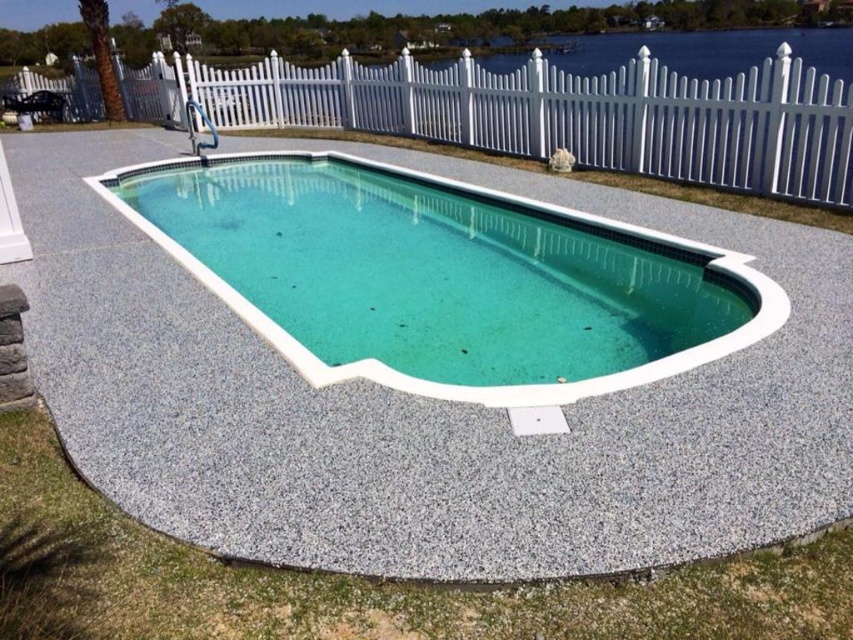
Question: From the image, what is the correct spatial relationship of white plastic fence at upper center in relation to clear acrylic pool at center?

Choices:
 (A) above
 (B) below

Answer: (A)

Question: Among these objects, which one is nearest to the camera?

Choices:
 (A) white plastic fence at upper center
 (B) clear acrylic pool at center

Answer: (B)

Question: Among these points, which one is farthest from the camera?

Choices:
 (A) (546, 70)
 (B) (769, 332)

Answer: (A)

Question: Where is white plastic fence at upper center located in relation to clear acrylic pool at center in the image?

Choices:
 (A) below
 (B) above

Answer: (B)

Question: Which object is farther from the camera taking this photo?

Choices:
 (A) white plastic fence at upper center
 (B) clear acrylic pool at center

Answer: (A)

Question: Is white plastic fence at upper center wider than clear acrylic pool at center?

Choices:
 (A) no
 (B) yes

Answer: (B)